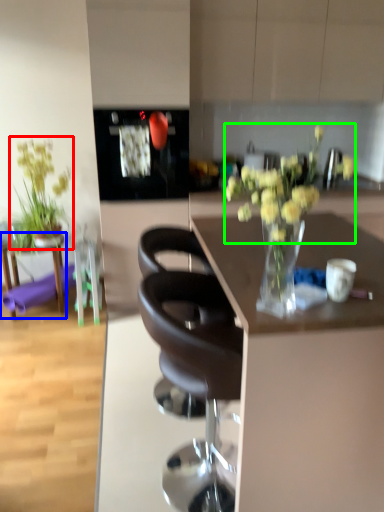
Question: Considering the real-world distances, which object is farthest from houseplant (highlighted by a red box)? table (highlighted by a blue box) or flower (highlighted by a green box)?

Choices:
 (A) table
 (B) flower

Answer: (B)